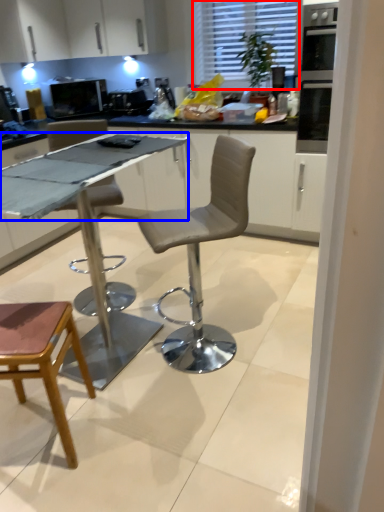
Question: Which point is further to the camera, window (highlighted by a red box) or counter top (highlighted by a blue box)?

Choices:
 (A) window
 (B) counter top

Answer: (A)